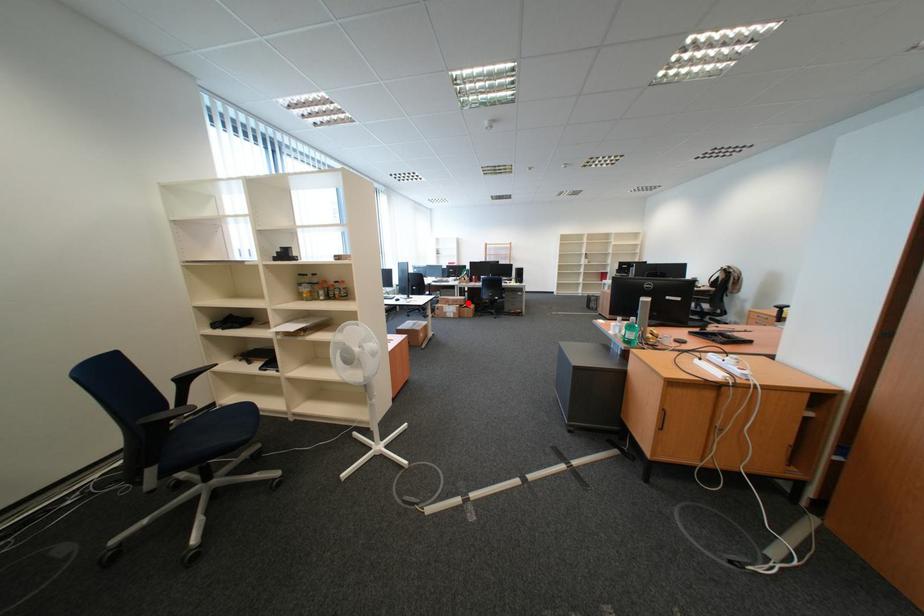
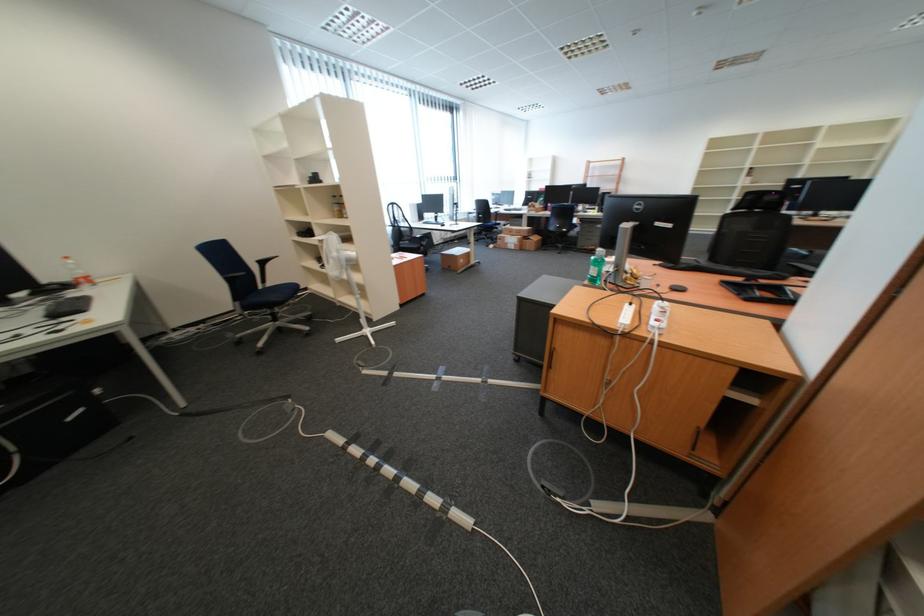
Question: I am providing you with two images of the same scene from different viewpoints. Given a red point in image1, look at the same physical point in image2. Is it:

Choices:
 (A) Closer to the viewpoint
 (B) Farther from the viewpoint

Answer: (A)